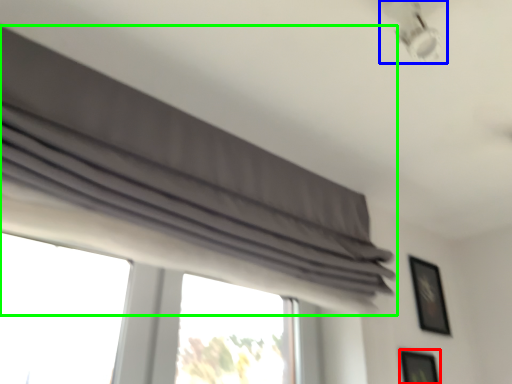
Question: Based on their relative distances, which object is farther from picture frame (highlighted by a red box)? Choose from lamp (highlighted by a blue box) and curtain (highlighted by a green box).

Choices:
 (A) lamp
 (B) curtain

Answer: (A)